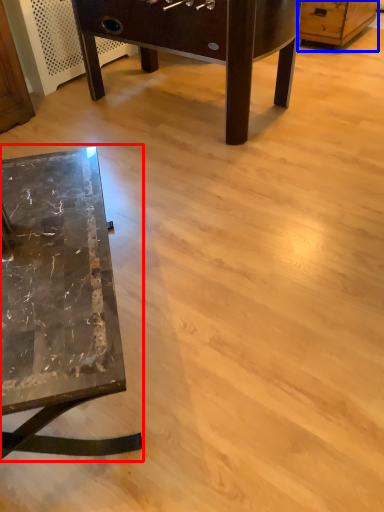
Question: Among these objects, which one is farthest to the camera, table (highlighted by a red box) or dresser (highlighted by a blue box)?

Choices:
 (A) table
 (B) dresser

Answer: (B)